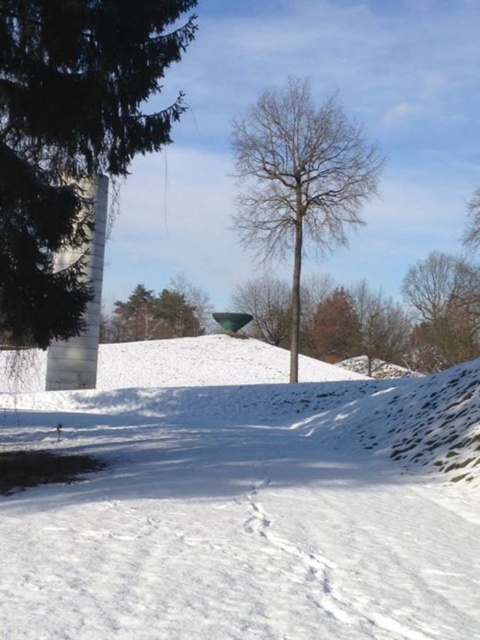
Who is positioned more to the right, white snow at center or bare wood tree at center?

bare wood tree at center

Which is behind, point (2, 512) or point (312, 228)?

Positioned behind is point (312, 228).

Which is behind, point (327, 400) or point (335, 202)?

The point (335, 202) is behind.

Locate an element on the screen. The height and width of the screenshot is (640, 480). white snow at center is located at coordinates (242, 499).

Is bare wood tree at center positioned behind green matte tree at upper center?

No, it is not.

Does bare wood tree at center have a greater height compared to green matte tree at upper center?

Correct, bare wood tree at center is much taller as green matte tree at upper center.

The width and height of the screenshot is (480, 640). Describe the element at coordinates (300, 179) in the screenshot. I see `bare wood tree at center` at that location.

Locate an element on the screen. bare wood tree at center is located at coordinates (300, 179).

Who is higher up, green matte tree at left or green matte tree at upper center?

green matte tree at left is above.

Is point (81, 35) less distant than point (165, 288)?

Yes, it is.

Identify the location of green matte tree at left. (72, 148).